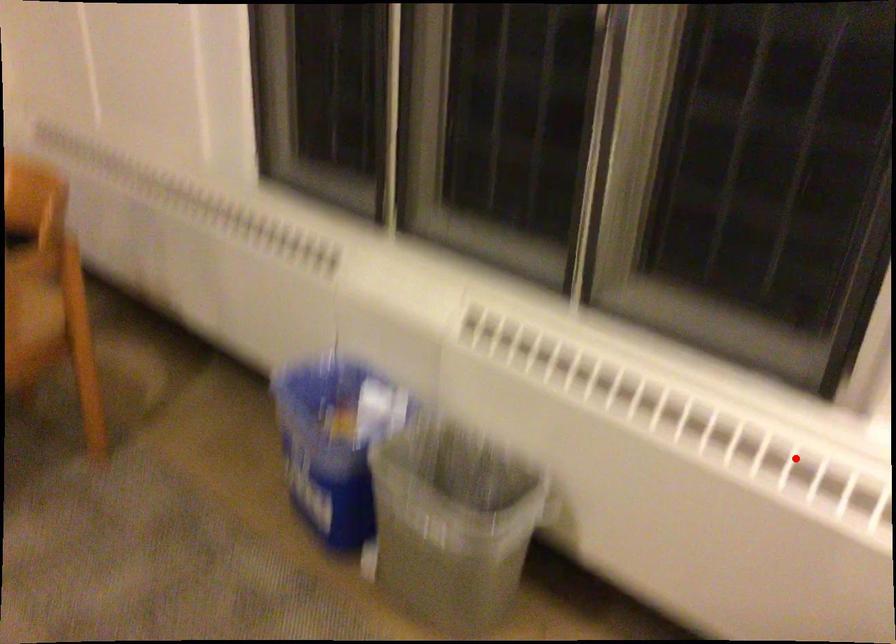
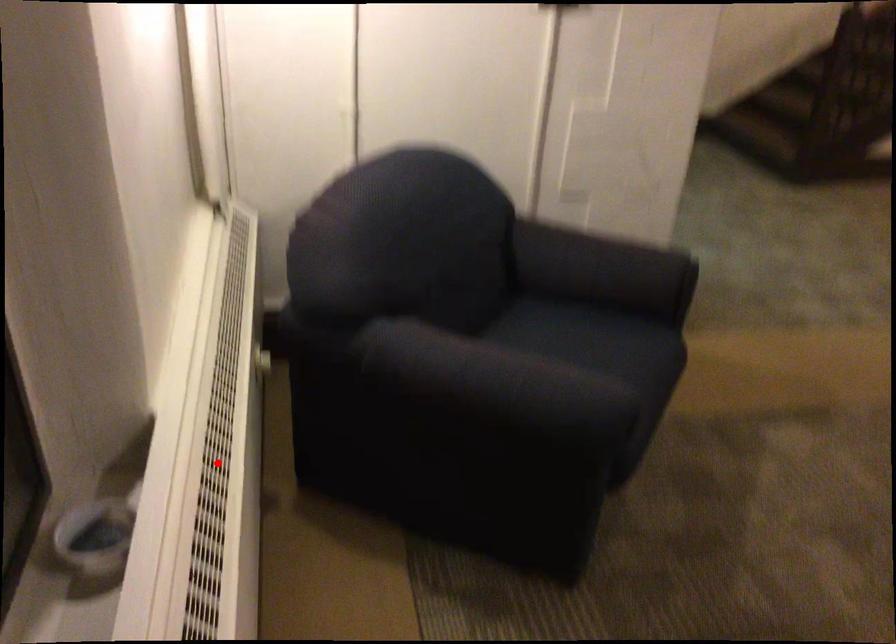
Based on the photo, I am providing you with two images of the same scene from different viewpoints. A red point is marked on the first image and another point is marked on the second image. Is the marked point in image1 the same physical position as the marked point in image2?

Yes